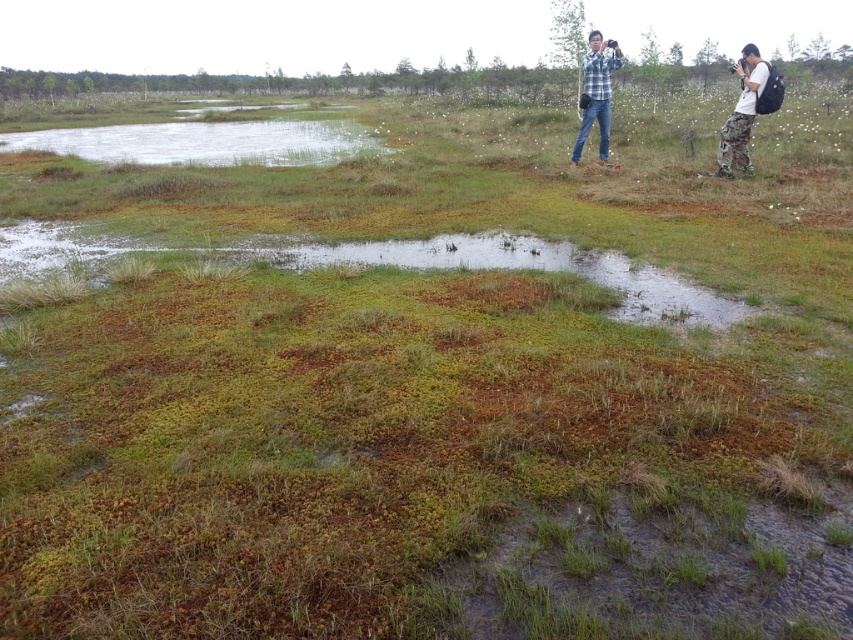
You are an outdoor enthusiast planning to cross the wetland area shown in the image. You notice the blue plaid shirt at upper right and the camouflage pants at right. Which clothing item appears smaller in size?

The blue plaid shirt at upper right appears smaller in size compared to the camouflage pants at right.